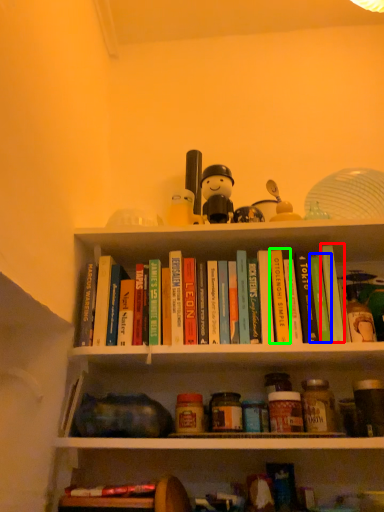
Question: Which object is the closest to the paperback book (highlighted by a red box)? Choose among these: paperback book (highlighted by a blue box) or paperback book (highlighted by a green box).

Choices:
 (A) paperback book
 (B) paperback book

Answer: (A)